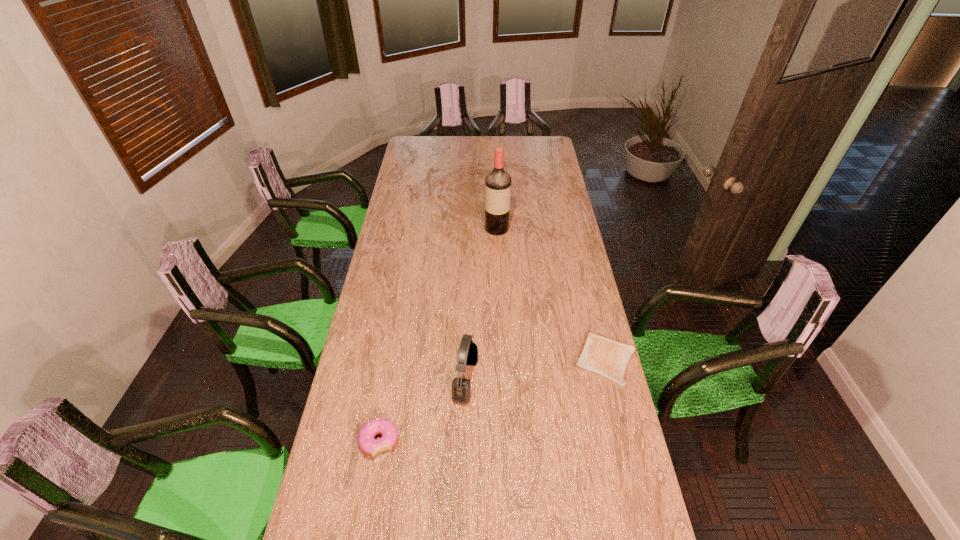
This screenshot has height=540, width=960. Identify the location of free spot on the desktop that is between the doughnut and the toast and is positioned on the front-facing side of the tallest object. (497, 399).

Locate an element on the screen. vacant space on the desktop that is between the nearest object and the shortest object and is positioned on the headband of the headset is located at coordinates (527, 388).